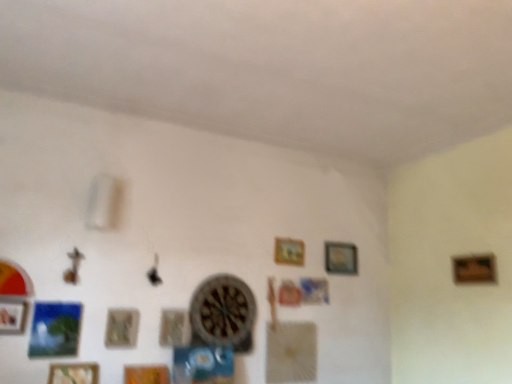
Question: In terms of width, does wooden textured picture frame at lower left, the sixth picture frame from the right, look wider or thinner when compared to wooden picture frame at upper center, positioned as the 2th picture frame in right-to-left order?

Choices:
 (A) wide
 (B) thin

Answer: (A)

Question: Is wooden textured picture frame at lower left, which is the 3th picture frame in left-to-right order, situated inside wooden picture frame at upper center, positioned as the 2th picture frame in right-to-left order, or outside?

Choices:
 (A) outside
 (B) inside

Answer: (A)

Question: Which object is the farthest from the wooden clock at center?

Choices:
 (A) wooden frame at right, the 8th picture frame when ordered from left to right
 (B) wooden picture frame at lower left, the 2th picture frame positioned from the left
 (C) wooden picture frame at lower center, which ranks as the fifth picture frame in right-to-left order
 (D) wooden picture frame at center, positioned as the fifth picture frame in left-to-right order
 (E) wooden textured picture frame at lower left, which is the 3th picture frame in left-to-right order

Answer: (A)

Question: Based on their relative distances, which object is nearer to the wooden textured picture frame at lower left, the sixth picture frame from the right?

Choices:
 (A) wooden frame at center, which appears as the 6th picture frame when viewed from the left
 (B) wooden frame at right, the 1th picture frame in the right-to-left sequence
 (C) wooden picture frame at lower center, which ranks as the fifth picture frame in right-to-left order
 (D) wooden picture frame at lower left, the first picture frame from the left
 (E) wooden clock at center

Answer: (C)